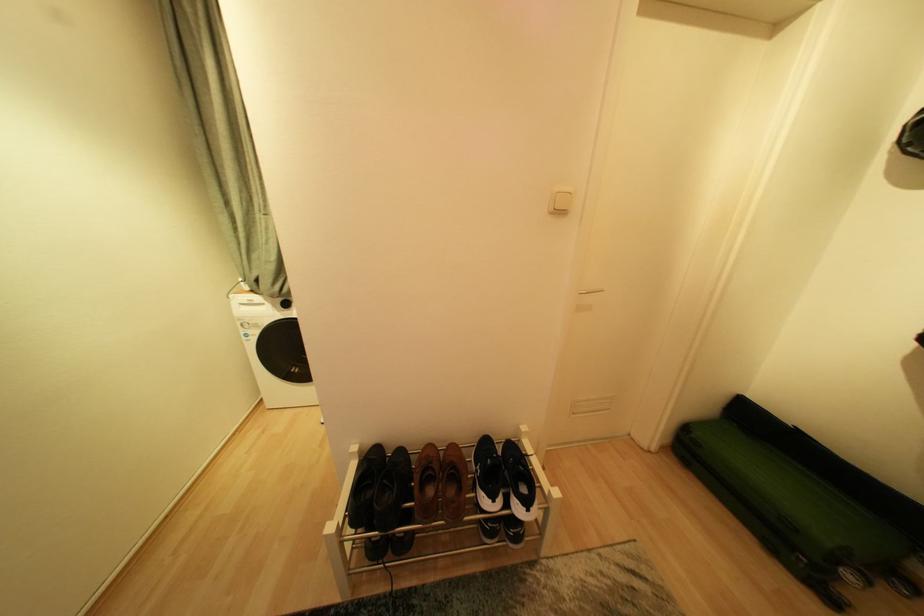
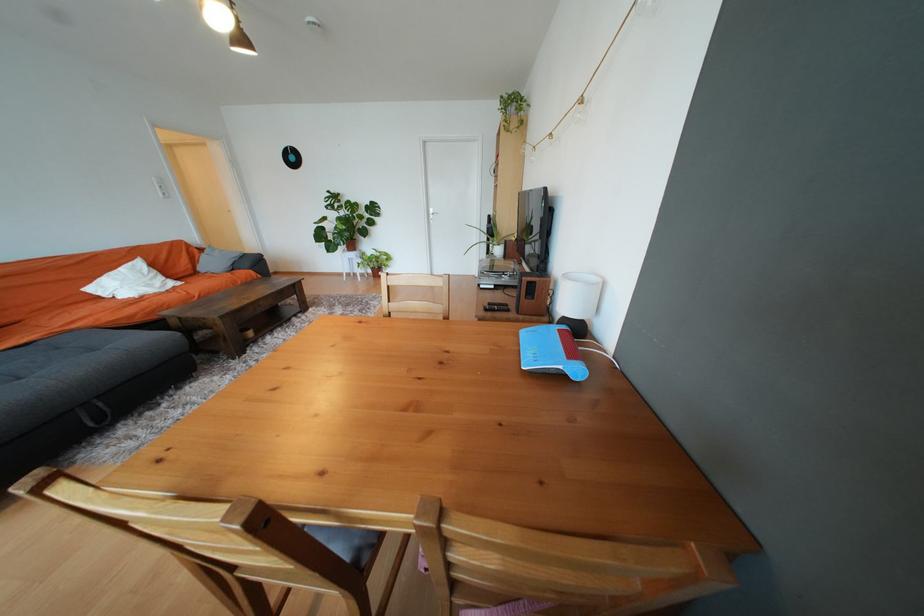
Question: I am providing you with two images of the same scene from different viewpoints. Please identify which objects are invisible in image2.

Choices:
 (A) white plant pot
 (B) grey suitcase
 (C) black shoe
 (D) sofa sitting surface

Answer: (C)